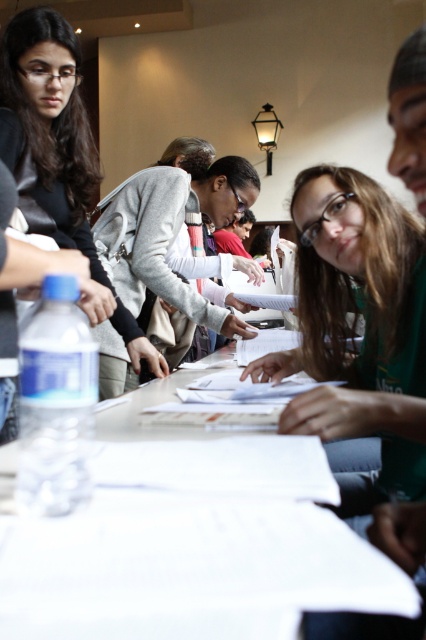
You are a participant at the table and want to hand your document to the person wearing the light gray sweater at center. Which direction should you move the white paper at center to give it to them?

The white paper at center is already to the right of the light gray sweater at center. To hand it to the person wearing the light gray sweater at center, you should move the white paper at center to the left towards them.

You are a photographer who needs to capture a candid shot of the matte black jacket at upper left without being noticed. The camera you have is 3.94 feet away from the jacket. Can you take the photo from your current position?

Yes, since the camera is 3.94 feet away from the matte black jacket at upper left, you can take the photo from your current position.